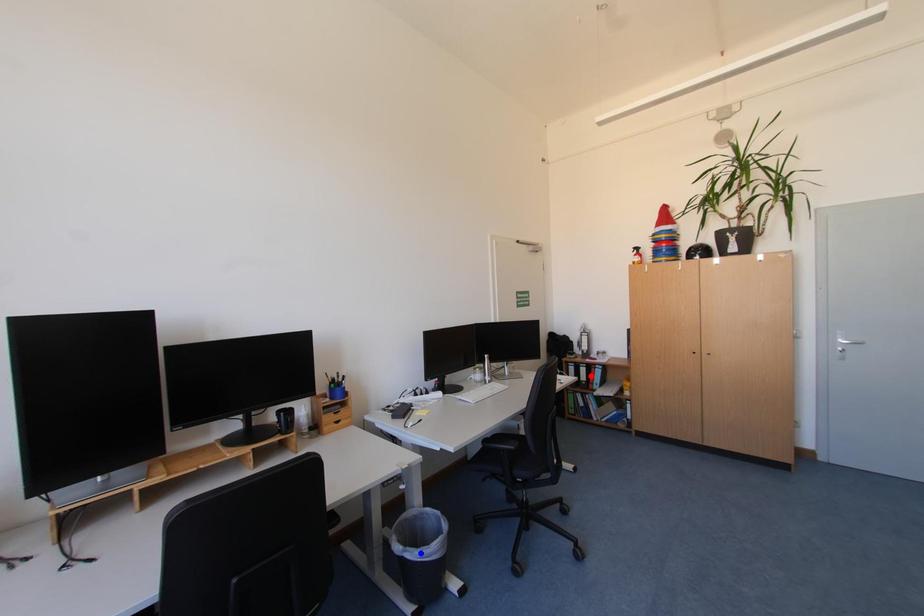
Question: Two points are marked on the image. Which point is closer to the camera?

Choices:
 (A) Blue point is closer.
 (B) Red point is closer.

Answer: (A)